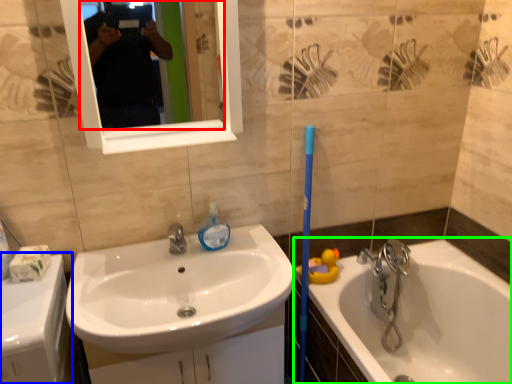
Question: Which object is the closest to the mirror (highlighted by a red box)? Choose among these: counter top (highlighted by a blue box) or bathtub (highlighted by a green box).

Choices:
 (A) counter top
 (B) bathtub

Answer: (A)